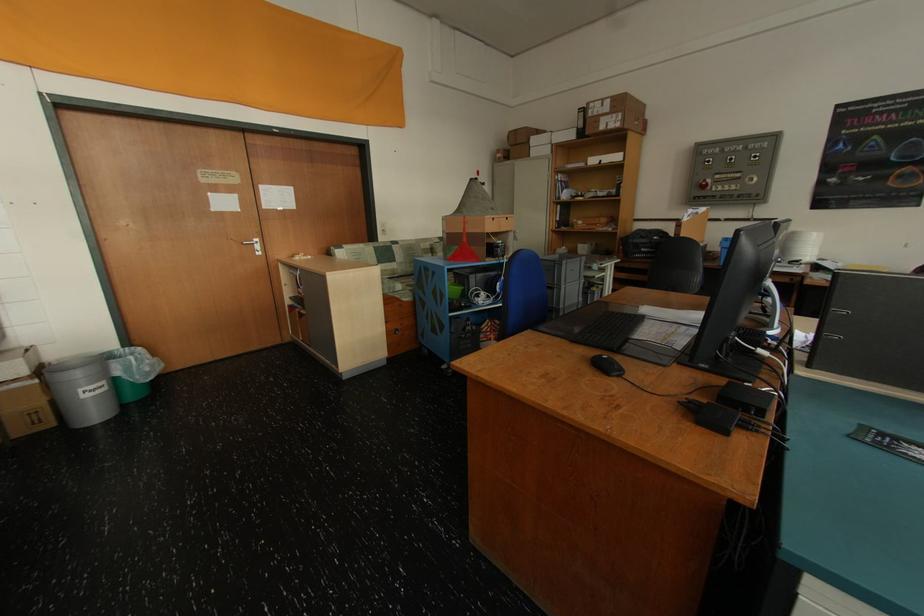
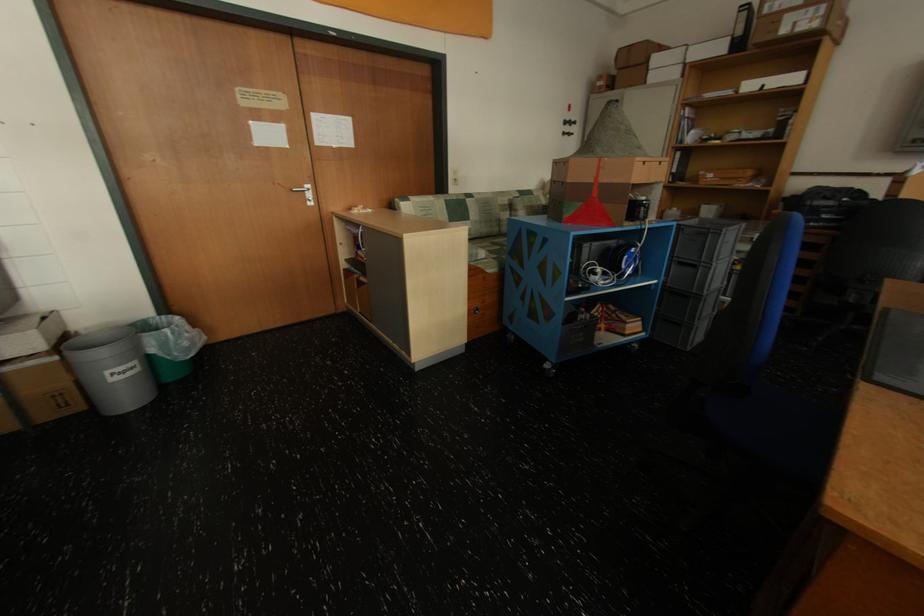
Locate, in the second image, the point that corresponds to point (465, 249) in the first image.

(589, 206)